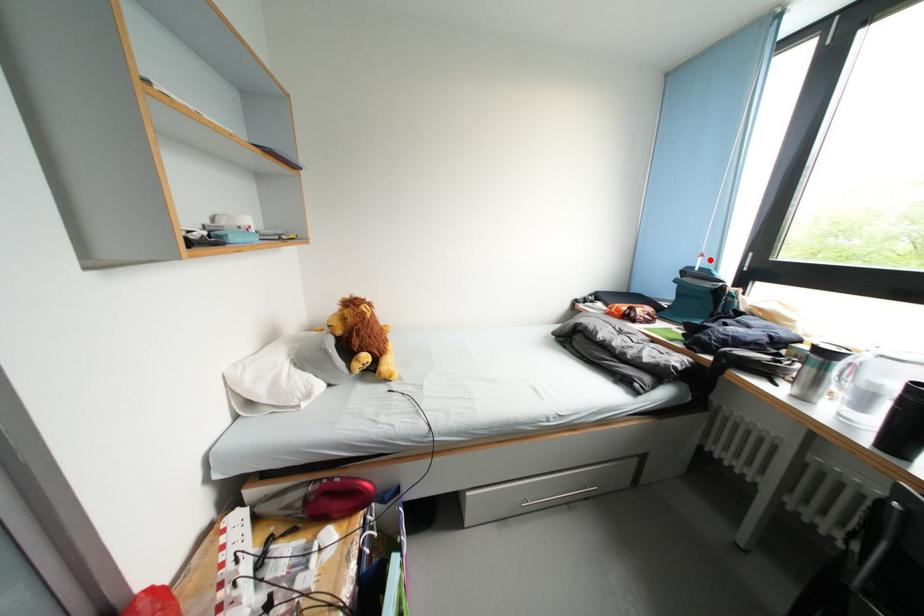
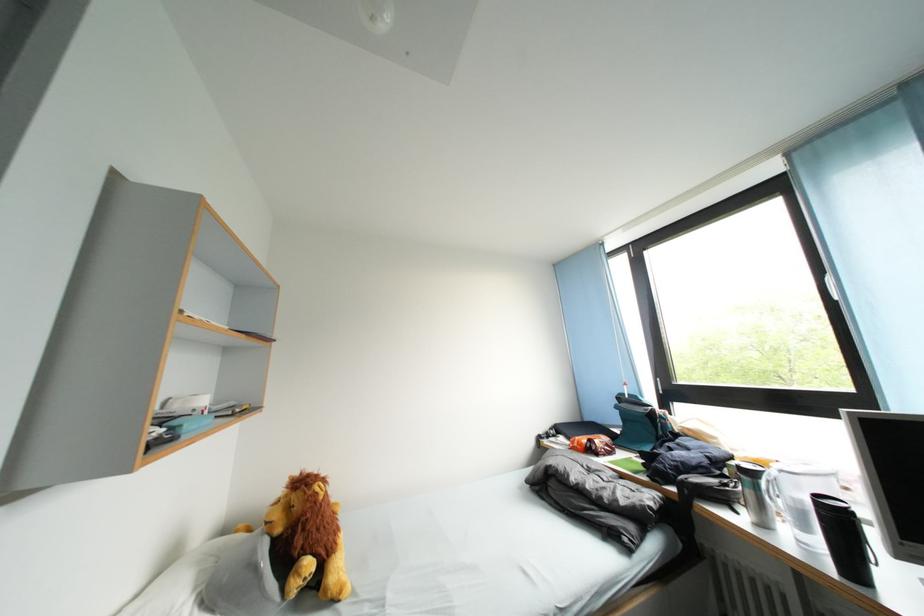
Find the pixel in the second image that matches the highlighted location in the first image.

(634, 389)